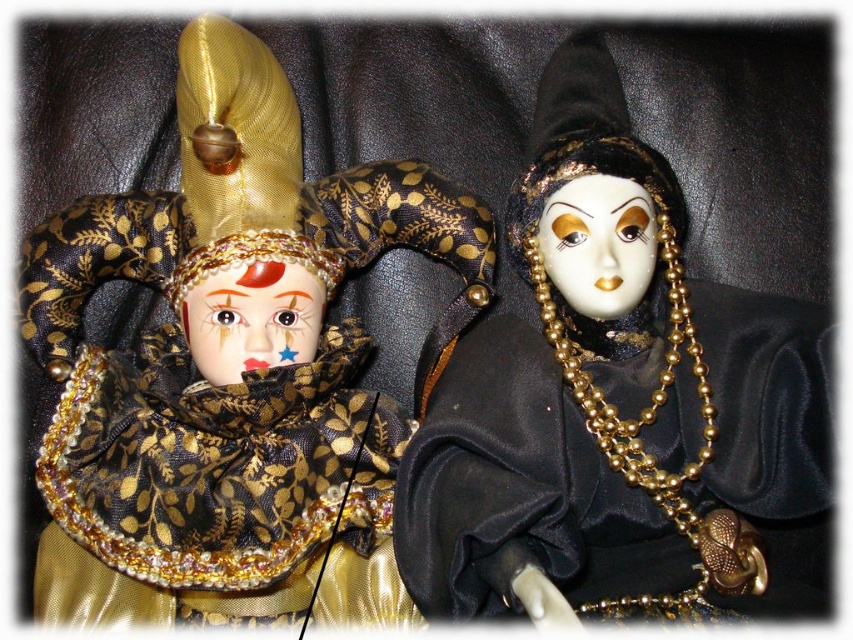
You are a photographer setting up a shot of the two dolls. You want to place a small light source between the two points marked as point (244, 465) and point (544, 234). Which point should the light be closer to so it doesn

The light should be closer to point (244, 465) because it is in front of point (544, 234), meaning it is closer to the viewer and thus the light would be more effective there.

What are the coordinates of the gold brocade jester at center?

The gold brocade jester at center is located at coordinates point [230,369].